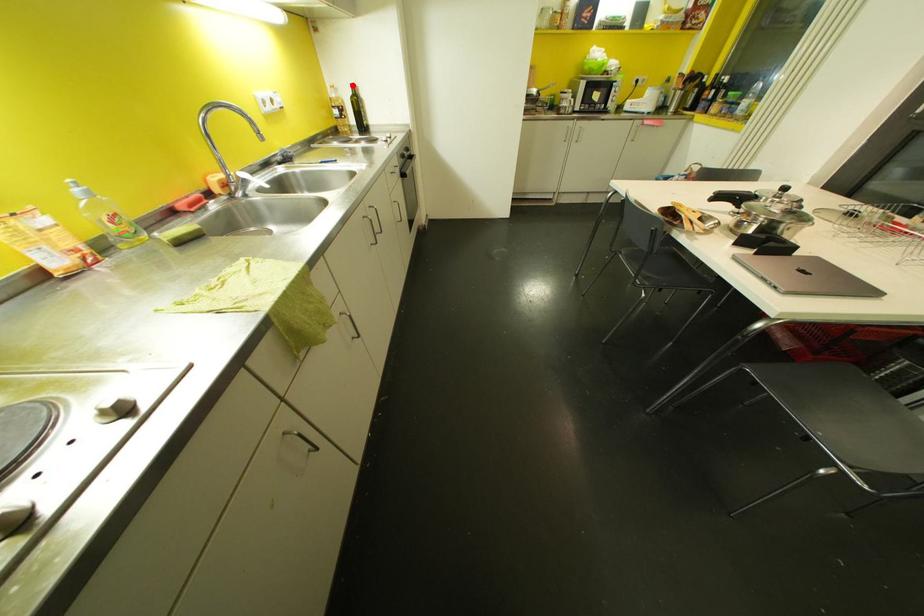
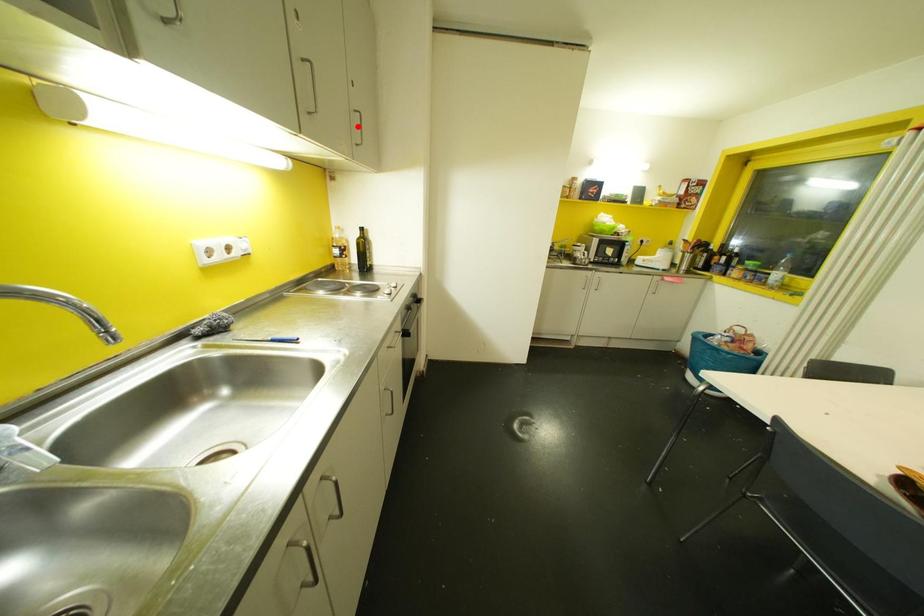
I am providing you with two images of the same scene from different viewpoints. A red point is marked on the first image and another point is marked on the second image. Is the red point in image1 aligned with the point shown in image2?

No